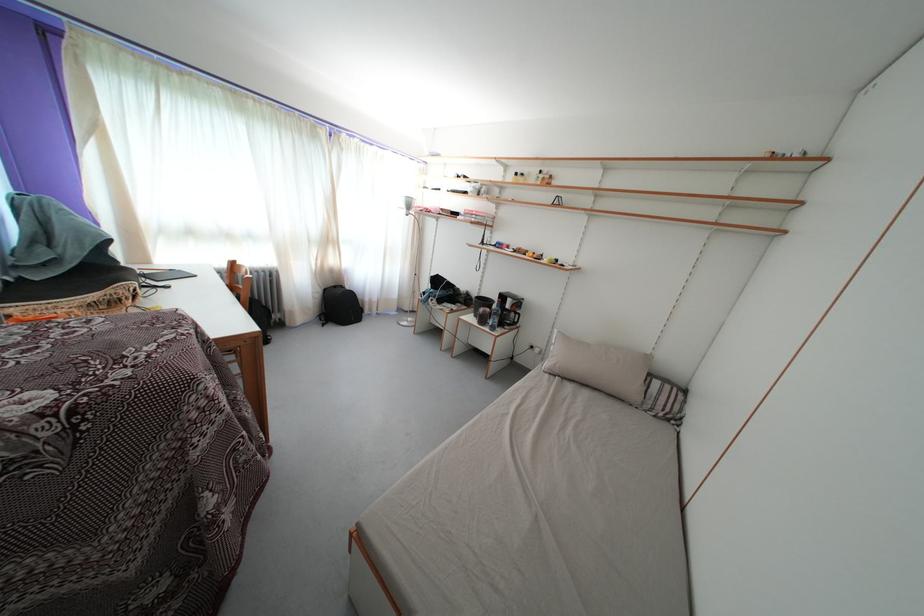
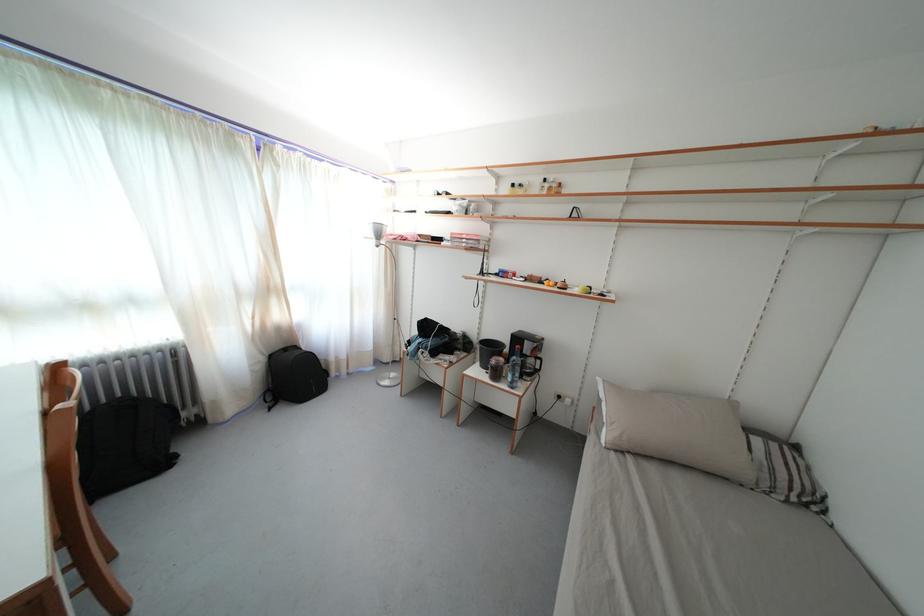
Find the pixel in the second image that matches the point at 666,408 in the first image.

(788, 482)